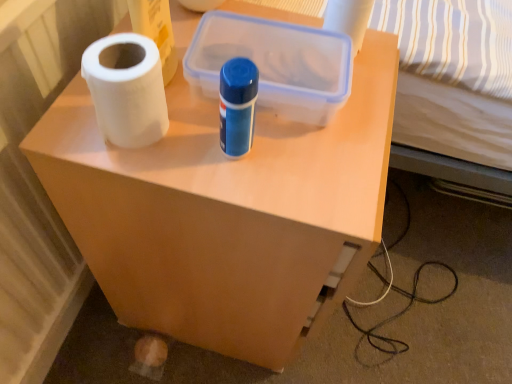
In order to click on empty space that is ontop of matte plastic side table at center in this screenshot , I will do `click(263, 100)`.